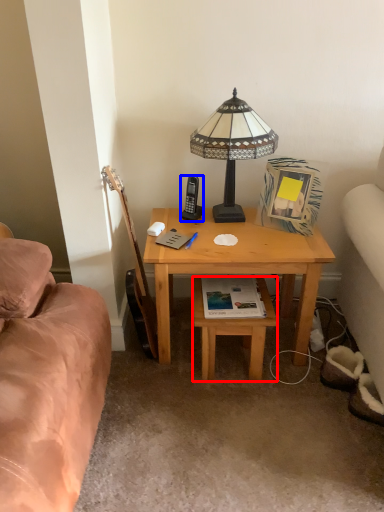
Question: Among these objects, which one is farthest to the camera, stool (highlighted by a red box) or mobile phone (highlighted by a blue box)?

Choices:
 (A) stool
 (B) mobile phone

Answer: (B)